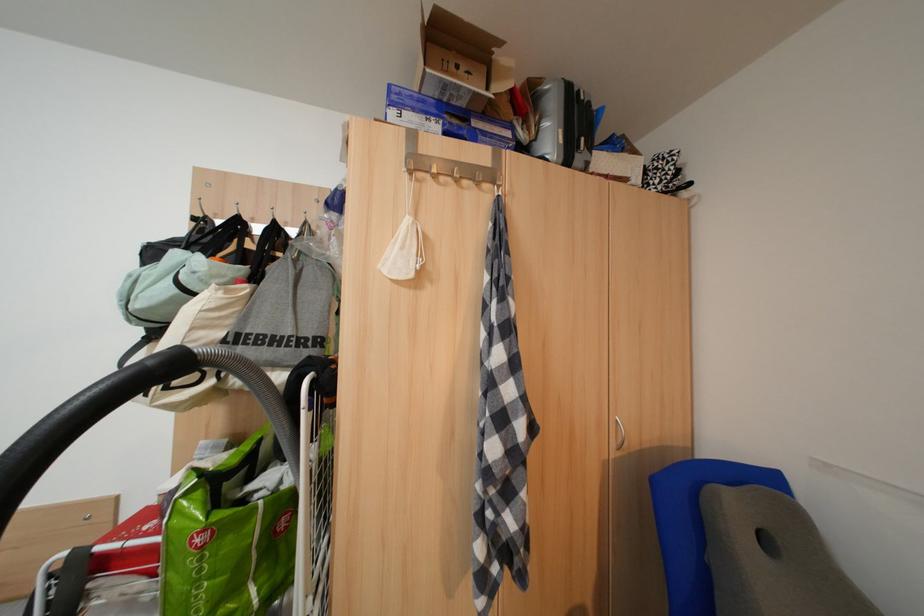
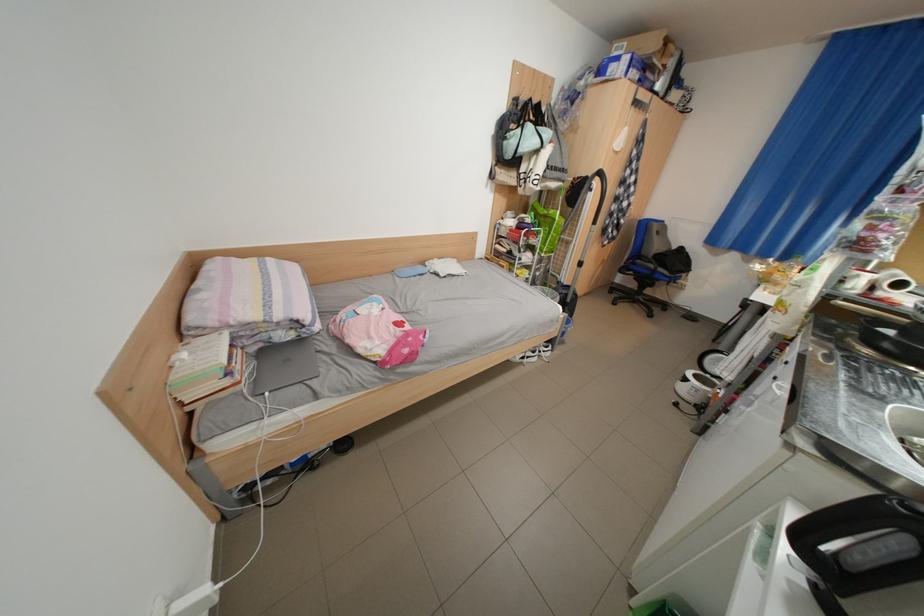
Where in the second image is the point corresponding to pixel 188 292 from the first image?

(552, 147)